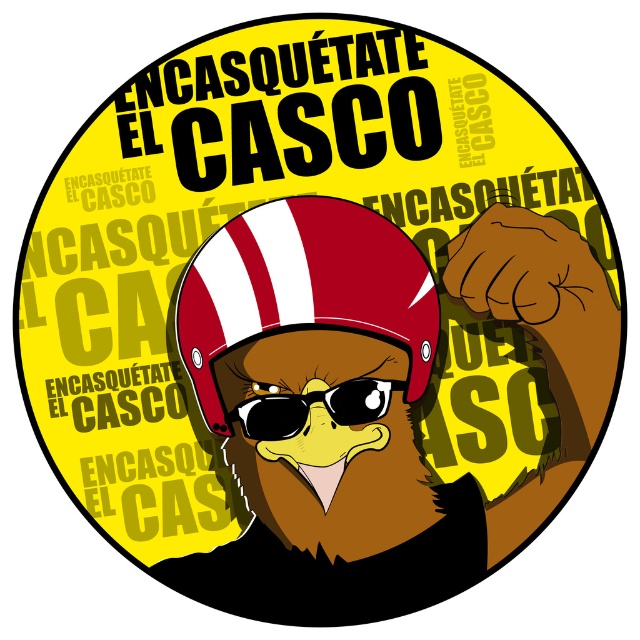
Question: Among these objects, which one is nearest to the camera?

Choices:
 (A) sunglassestransparent at center
 (B) shiny red helmet at center

Answer: (B)

Question: Is shiny red helmet at center bigger than sunglassestransparent at center?

Choices:
 (A) no
 (B) yes

Answer: (B)

Question: Which object appears farthest from the camera in this image?

Choices:
 (A) sunglassestransparent at center
 (B) shiny red helmet at center

Answer: (A)

Question: Considering the relative positions of shiny red helmet at center and sunglassestransparent at center in the image provided, where is shiny red helmet at center located with respect to sunglassestransparent at center?

Choices:
 (A) left
 (B) right

Answer: (A)

Question: Is shiny red helmet at center to the right of sunglassestransparent at center from the viewer's perspective?

Choices:
 (A) yes
 (B) no

Answer: (B)